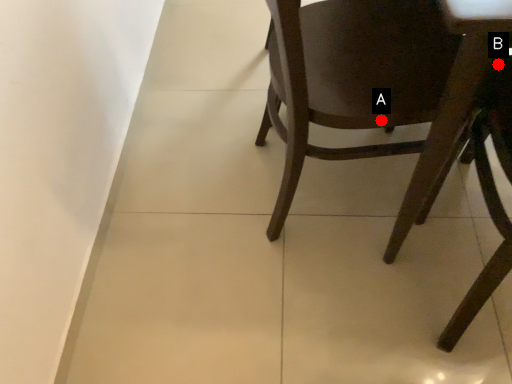
Question: Two points are circled on the image, labeled by A and B beside each circle. Which point is closer to the camera?

Choices:
 (A) A is closer
 (B) B is closer

Answer: (B)